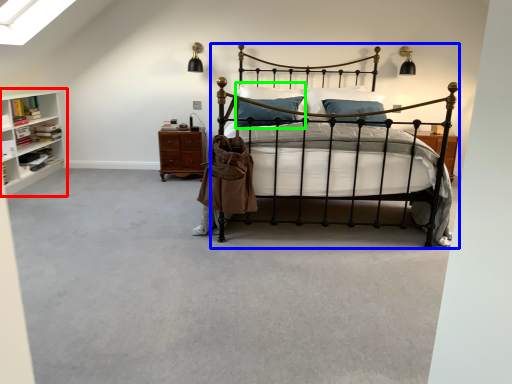
Question: Which object is the farthest from shelf (highlighted by a red box)? Choose among these: bed (highlighted by a blue box) or pillow (highlighted by a green box).

Choices:
 (A) bed
 (B) pillow

Answer: (A)